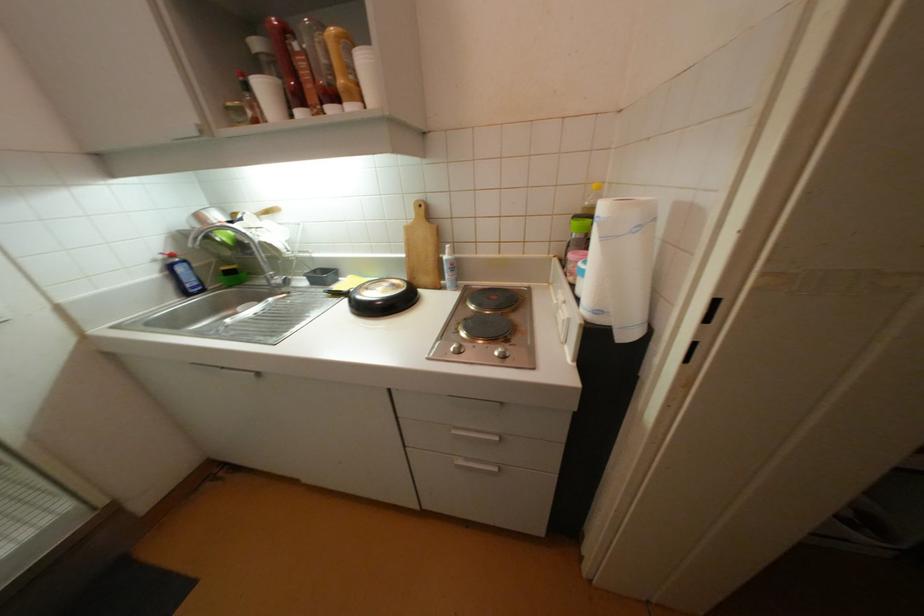
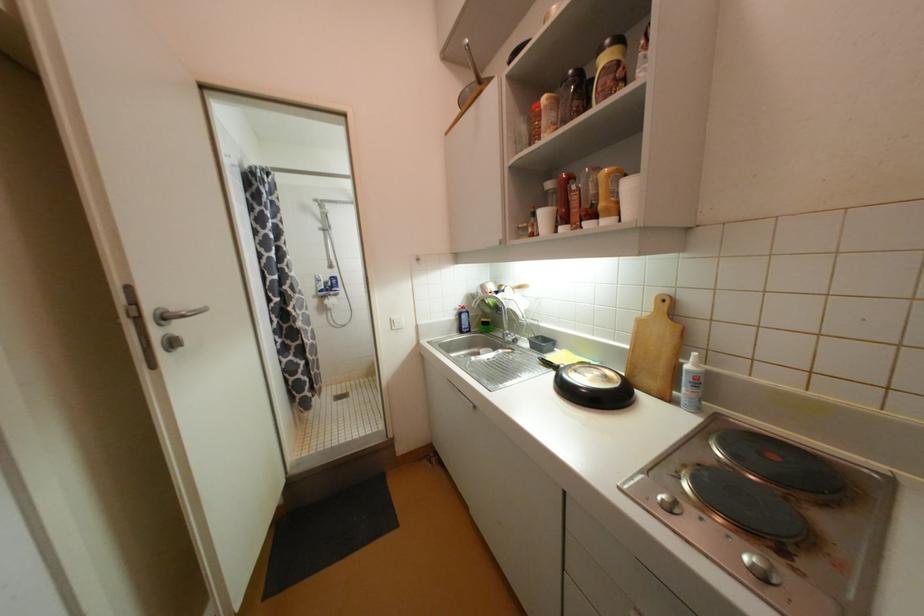
Locate, in the second image, the point that corresponds to (x=341, y=100) in the first image.

(600, 217)